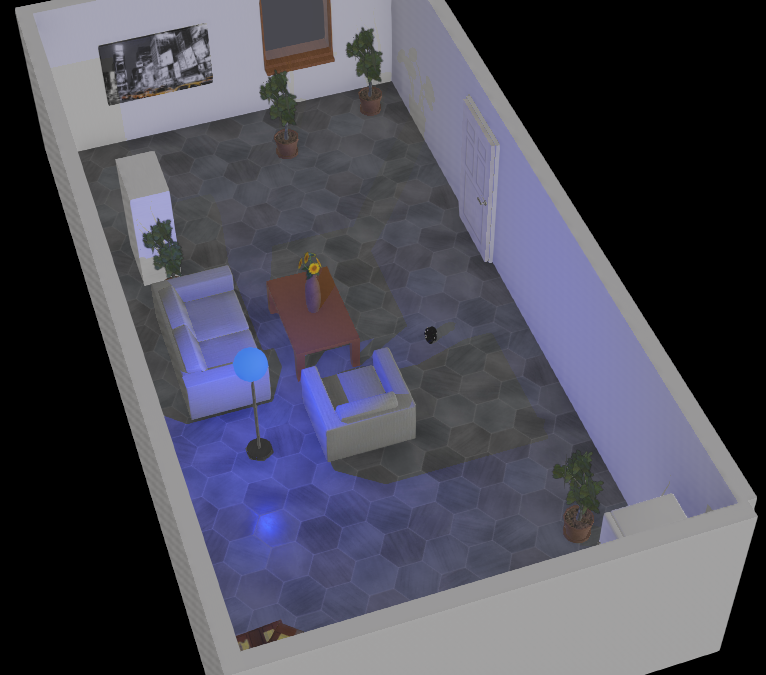
Where is `door`? This screenshot has width=766, height=675. door is located at coordinates (470, 196).